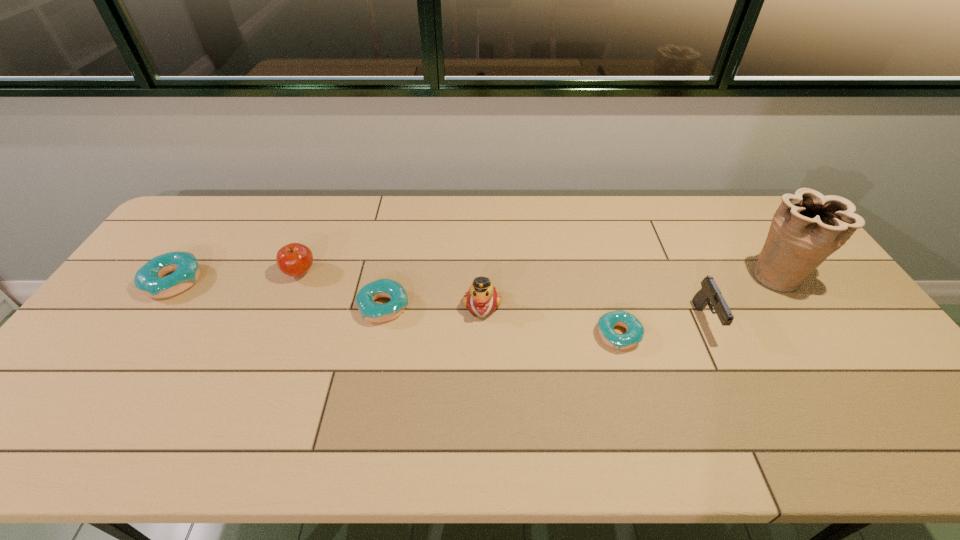
Given the evenly spaced doughnuts in the image, where should an extra doughnut be added on the right to preserve the spacing? Please point to a vacant space. Please provide its 2D coordinates. Your answer should be formatted as a tuple, i.e. [(x, y)], where the tuple contains the x and y coordinates of a point satisfying the conditions above.

[(884, 367)]